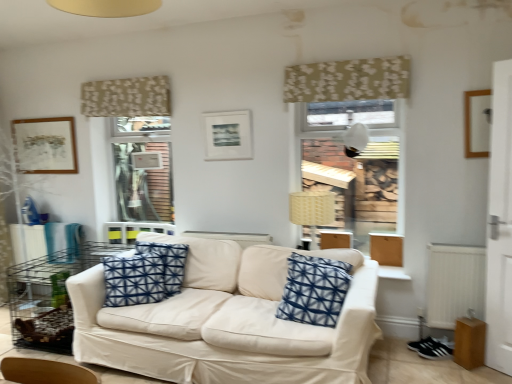
Question: Is matte brown picture frame at upper left, which appears as the third picture frame when viewed from the front, to the right of wooden picture frame at upper right, which is the 3th picture frame from left to right, from the viewer's perspective?

Choices:
 (A) yes
 (B) no

Answer: (B)

Question: Can you confirm if matte brown picture frame at upper left, which is counted as the 3th picture frame, starting from the right, is wider than wooden picture frame at upper right, positioned as the 1th picture frame in front-to-back order?

Choices:
 (A) no
 (B) yes

Answer: (A)

Question: Is wooden picture frame at upper right, which is the 3th picture frame from left to right, located within matte brown picture frame at upper left, placed as the 1th picture frame when sorted from left to right?

Choices:
 (A) yes
 (B) no

Answer: (B)

Question: Does matte brown picture frame at upper left, placed as the 1th picture frame when sorted from left to right, have a lesser width compared to wooden picture frame at upper right, the 1th picture frame in the right-to-left sequence?

Choices:
 (A) no
 (B) yes

Answer: (B)

Question: From a real-world perspective, is matte brown picture frame at upper left, which appears as the third picture frame when viewed from the front, beneath wooden picture frame at upper right, the 1th picture frame in the right-to-left sequence?

Choices:
 (A) yes
 (B) no

Answer: (A)

Question: Is matte brown picture frame at upper left, placed as the 1th picture frame when sorted from left to right, smaller than wooden picture frame at upper right, positioned as the 1th picture frame in front-to-back order?

Choices:
 (A) yes
 (B) no

Answer: (B)

Question: Can you confirm if metal wire table at left is wider than beige floral fabric at upper center, the 1th curtain positioned from the front?

Choices:
 (A) no
 (B) yes

Answer: (B)

Question: Is metal wire table at left taller than beige floral fabric at upper center, the 1th curtain positioned from the front?

Choices:
 (A) no
 (B) yes

Answer: (B)

Question: Could you tell me if metal wire table at left is turned towards beige floral fabric at upper center, which is the 2th curtain from back to front?

Choices:
 (A) yes
 (B) no

Answer: (B)

Question: From a real-world perspective, is metal wire table at left over beige floral fabric at upper center, the 1th curtain positioned from the front?

Choices:
 (A) no
 (B) yes

Answer: (A)

Question: Is metal wire table at left to the right of beige floral fabric at upper center, which ranks as the 2th curtain in left-to-right order, from the viewer's perspective?

Choices:
 (A) no
 (B) yes

Answer: (A)

Question: From the image's perspective, is metal wire table at left located above beige floral fabric at upper center, which is the 2th curtain from back to front?

Choices:
 (A) no
 (B) yes

Answer: (A)

Question: From a real-world perspective, is white fabric couch at center on beige floral fabric at upper center, acting as the first curtain starting from the left?

Choices:
 (A) yes
 (B) no

Answer: (B)